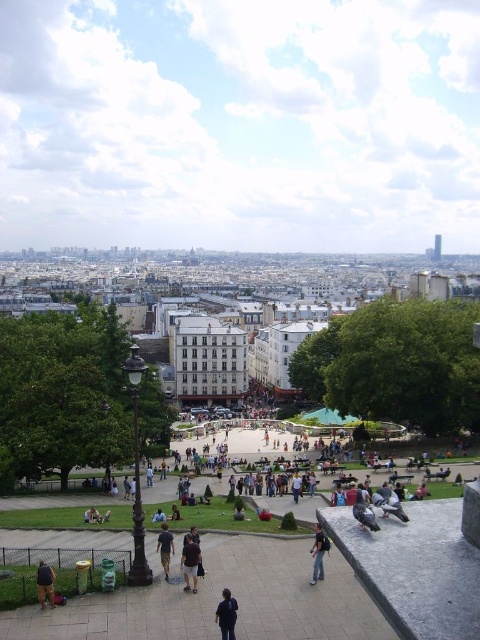
Is point (192, 564) positioned before point (323, 541)?

Yes, it is in front of point (323, 541).

Does point (195, 570) come closer to viewer compared to point (319, 556)?

Yes.

Locate an element on the screen. dark blue shirt at center is located at coordinates (191, 563).

Can you confirm if brown leather jacket at lower left is bigger than jeans at lower center?

Incorrect, brown leather jacket at lower left is not larger than jeans at lower center.

Image resolution: width=480 pixels, height=640 pixels. Describe the element at coordinates (45, 584) in the screenshot. I see `brown leather jacket at lower left` at that location.

The image size is (480, 640). I want to click on brown leather jacket at lower left, so click(45, 584).

Between dark blue shirt at center and dark brown leather jacket at center, which one appears on the left side from the viewer's perspective?

From the viewer's perspective, dark brown leather jacket at center appears more on the left side.

Find the location of a particular element. This screenshot has width=480, height=640. dark blue shirt at center is located at coordinates (191, 563).

Image resolution: width=480 pixels, height=640 pixels. I want to click on dark blue shirt at center, so click(191, 563).